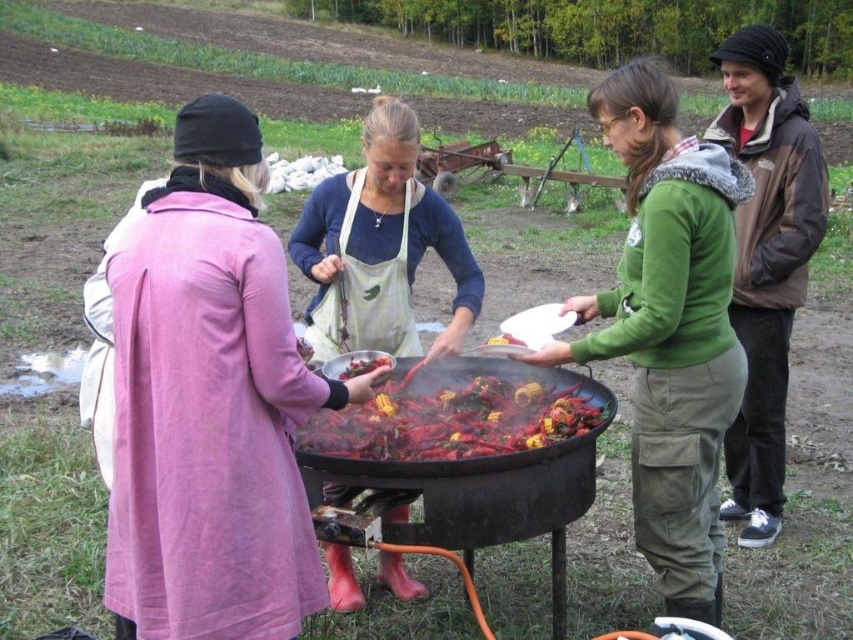
Question: Which of the following is the farthest from the observer?

Choices:
 (A) pink fabric coat at center
 (B) green fleece jacket at center

Answer: (B)

Question: Among these objects, which one is farthest from the camera?

Choices:
 (A) brown woolen hat at upper right
 (B) charcoal grill at center
 (C) smooth glossy corn at center

Answer: (C)

Question: Is white apron at center below natural linen apron at center?

Choices:
 (A) yes
 (B) no

Answer: (B)

Question: Can you confirm if charcoal black pot at center is thinner than shiny red berries at center?

Choices:
 (A) no
 (B) yes

Answer: (A)

Question: Where is green fleece jacket at center located in relation to smooth glossy corn at center in the image?

Choices:
 (A) left
 (B) right

Answer: (B)

Question: Which point is closer to the camera?

Choices:
 (A) (520, 460)
 (B) (383, 272)

Answer: (A)